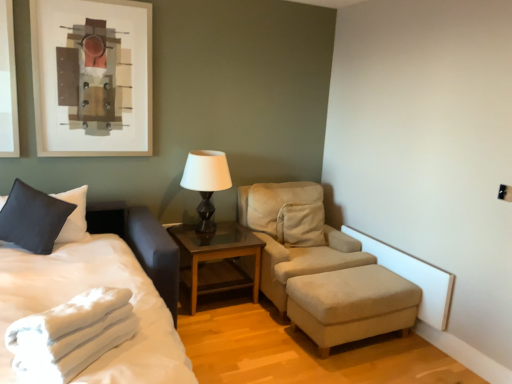
Question: Is matte black pillow at left wider than beige fabric studio couch at center?

Choices:
 (A) yes
 (B) no

Answer: (B)

Question: Is matte black pillow at left bigger than beige fabric studio couch at center?

Choices:
 (A) no
 (B) yes

Answer: (A)

Question: From the image's perspective, does matte black pillow at left appear higher than beige fabric studio couch at center?

Choices:
 (A) yes
 (B) no

Answer: (A)

Question: Considering the relative sizes of matte black pillow at left and beige fabric studio couch at center in the image provided, is matte black pillow at left shorter than beige fabric studio couch at center?

Choices:
 (A) yes
 (B) no

Answer: (A)

Question: Is matte black pillow at left taller than beige fabric studio couch at center?

Choices:
 (A) no
 (B) yes

Answer: (A)

Question: Based on their positions, is matte black pillow at left located to the left or right of white soft bed at left?

Choices:
 (A) right
 (B) left

Answer: (B)

Question: From the image's perspective, is matte black pillow at left positioned above or below white soft bed at left?

Choices:
 (A) below
 (B) above

Answer: (B)

Question: Looking at their shapes, would you say matte black pillow at left is wider or thinner than white soft bed at left?

Choices:
 (A) thin
 (B) wide

Answer: (A)

Question: From their relative heights in the image, would you say matte black pillow at left is taller or shorter than white soft bed at left?

Choices:
 (A) short
 (B) tall

Answer: (A)

Question: Considering the positions of matte black pillow at left and beige fabric ottoman at lower right in the image, is matte black pillow at left bigger or smaller than beige fabric ottoman at lower right?

Choices:
 (A) small
 (B) big

Answer: (A)

Question: Is point (77, 210) closer or farther from the camera than point (331, 274)?

Choices:
 (A) farther
 (B) closer

Answer: (B)

Question: Looking at their shapes, would you say matte black pillow at left is wider or thinner than beige fabric ottoman at lower right?

Choices:
 (A) thin
 (B) wide

Answer: (A)

Question: From their relative heights in the image, would you say matte black pillow at left is taller or shorter than beige fabric ottoman at lower right?

Choices:
 (A) tall
 (B) short

Answer: (A)

Question: Based on their sizes in the image, would you say beige fabric ottoman at lower right is bigger or smaller than white soft towel at lower left?

Choices:
 (A) big
 (B) small

Answer: (A)

Question: From the image's perspective, is beige fabric ottoman at lower right above or below white soft towel at lower left?

Choices:
 (A) above
 (B) below

Answer: (B)